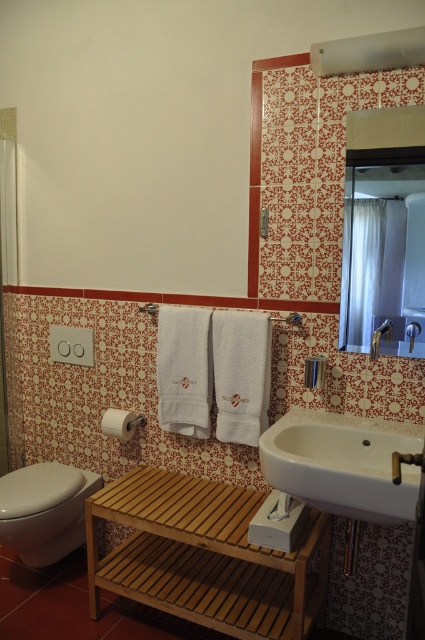
Question: Can you confirm if white glossy toilet bowl at lower left is positioned below transparent plastic screen door at left?

Choices:
 (A) yes
 (B) no

Answer: (A)

Question: Among these points, which one is nearest to the camera?

Choices:
 (A) (54, 481)
 (B) (407, 205)
 (C) (323, 417)

Answer: (B)

Question: Which point appears closest to the camera in this image?

Choices:
 (A) pyautogui.click(x=419, y=216)
 (B) pyautogui.click(x=14, y=204)
 (C) pyautogui.click(x=113, y=435)
 (D) pyautogui.click(x=379, y=326)

Answer: (A)

Question: Which of the following is the closest to the observer?

Choices:
 (A) silver metallic faucet at upper right
 (B) white matte toilet paper at lower left
 (C) glossy glass mirror at upper center

Answer: (C)

Question: Does wooden stool at lower center have a greater width compared to transparent plastic screen door at left?

Choices:
 (A) no
 (B) yes

Answer: (B)

Question: Can you confirm if wooden stool at lower center is thinner than white glossy toilet bowl at lower left?

Choices:
 (A) yes
 (B) no

Answer: (B)